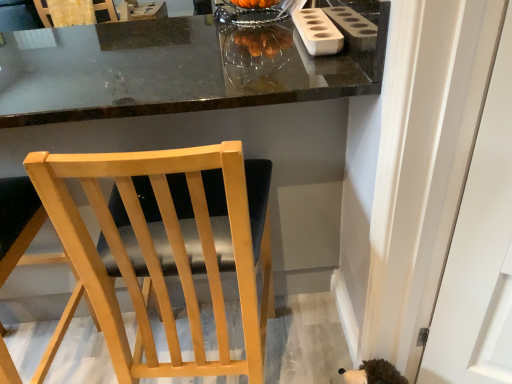
Question: Can you confirm if matte black table at center is thinner than white matte holder at upper right?

Choices:
 (A) no
 (B) yes

Answer: (A)

Question: From a real-world perspective, does matte black table at center sit lower than white matte holder at upper right?

Choices:
 (A) yes
 (B) no

Answer: (A)

Question: Is matte black table at center in front of white matte holder at upper right?

Choices:
 (A) yes
 (B) no

Answer: (A)

Question: From the image's perspective, would you say matte black table at center is shown under white matte holder at upper right?

Choices:
 (A) yes
 (B) no

Answer: (A)

Question: Is matte black table at center at the right side of white matte holder at upper right?

Choices:
 (A) yes
 (B) no

Answer: (B)

Question: Is matte black table at center turned away from white matte holder at upper right?

Choices:
 (A) no
 (B) yes

Answer: (A)

Question: Does matte black table at center have a greater height compared to wooden chair at upper left, which is the third chair from bottom to top?

Choices:
 (A) no
 (B) yes

Answer: (B)

Question: Is wooden chair at upper left, the first chair positioned from the back, inside matte black table at center?

Choices:
 (A) no
 (B) yes

Answer: (A)

Question: Is matte black table at center smaller than wooden chair at upper left, the first chair positioned from the back?

Choices:
 (A) yes
 (B) no

Answer: (B)

Question: Is matte black table at center next to wooden chair at upper left, the first chair positioned from the back, and touching it?

Choices:
 (A) yes
 (B) no

Answer: (B)

Question: Is wooden chair at upper left, the 1th chair viewed from the left, at the back of matte black table at center?

Choices:
 (A) no
 (B) yes

Answer: (A)

Question: From the image's perspective, is matte black table at center under wooden chair at upper left, the 1th chair viewed from the left?

Choices:
 (A) yes
 (B) no

Answer: (A)

Question: Is white matte holder at upper right bigger than matte black table at center?

Choices:
 (A) yes
 (B) no

Answer: (B)